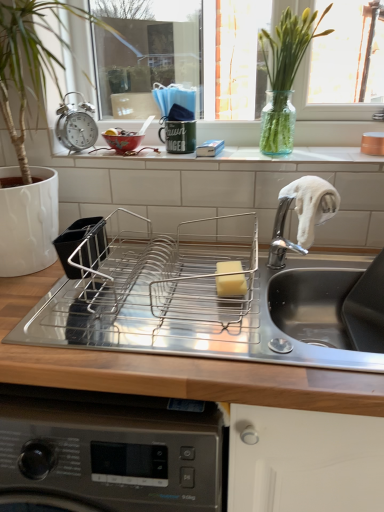
Question: Is metallic alarm clock at upper left to the right of stainless steel dish rack at center from the viewer's perspective?

Choices:
 (A) no
 (B) yes

Answer: (A)

Question: From the image's perspective, is metallic alarm clock at upper left located beneath stainless steel dish rack at center?

Choices:
 (A) yes
 (B) no

Answer: (B)

Question: Is metallic alarm clock at upper left far away from stainless steel dish rack at center?

Choices:
 (A) no
 (B) yes

Answer: (A)

Question: Is metallic alarm clock at upper left smaller than stainless steel dish rack at center?

Choices:
 (A) yes
 (B) no

Answer: (A)

Question: Considering the relative positions of metallic alarm clock at upper left and stainless steel dish rack at center in the image provided, is metallic alarm clock at upper left in front of stainless steel dish rack at center?

Choices:
 (A) no
 (B) yes

Answer: (A)

Question: In terms of size, does metallic alarm clock at upper left appear bigger or smaller than green glass vase at upper center?

Choices:
 (A) big
 (B) small

Answer: (B)

Question: From a real-world perspective, is metallic alarm clock at upper left positioned above or below green glass vase at upper center?

Choices:
 (A) above
 (B) below

Answer: (B)

Question: Does point (89, 124) appear closer or farther from the camera than point (329, 8)?

Choices:
 (A) closer
 (B) farther

Answer: (B)

Question: Which is correct: metallic alarm clock at upper left is inside green glass vase at upper center, or outside of it?

Choices:
 (A) outside
 (B) inside

Answer: (A)

Question: From the image's perspective, is green glass vase at upper center located above or below white ceramic window sill at center?

Choices:
 (A) above
 (B) below

Answer: (A)

Question: Relative to white ceramic window sill at center, is green glass vase at upper center in front or behind?

Choices:
 (A) behind
 (B) front

Answer: (B)

Question: From a real-world perspective, is green glass vase at upper center physically located above or below white ceramic window sill at center?

Choices:
 (A) above
 (B) below

Answer: (A)

Question: Is green glass vase at upper center situated inside white ceramic window sill at center or outside?

Choices:
 (A) outside
 (B) inside

Answer: (A)

Question: Is stainless steel sink at center bigger or smaller than metallic alarm clock at upper left?

Choices:
 (A) small
 (B) big

Answer: (B)

Question: From a real-world perspective, is stainless steel sink at center positioned above or below metallic alarm clock at upper left?

Choices:
 (A) below
 (B) above

Answer: (A)